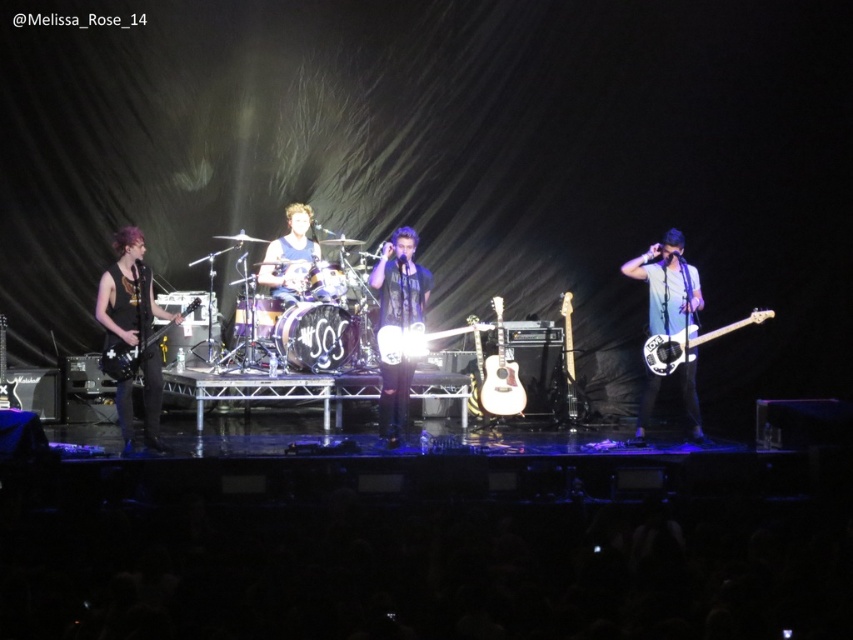
Question: Which point is farther to the camera?

Choices:
 (A) white matte acoustic guitar at center
 (B) blue fabric shirt at center
 (C) black matte shirt at center

Answer: (A)

Question: Can you confirm if black matte shirt at center is positioned to the left of white matte acoustic guitar at center?

Choices:
 (A) yes
 (B) no

Answer: (A)

Question: Is the position of black matte guitar at left less distant than that of white matte acoustic guitar at center?

Choices:
 (A) no
 (B) yes

Answer: (B)

Question: Is black matte shirt at center further to the viewer compared to shiny gold electric guitar at center?

Choices:
 (A) yes
 (B) no

Answer: (B)

Question: Which object is farther from the camera taking this photo?

Choices:
 (A) blue fabric shirt at center
 (B) light brown acoustic guitar at center

Answer: (A)

Question: Which of the following is the closest to the observer?

Choices:
 (A) black matte guitar at left
 (B) shiny gold electric guitar at center
 (C) shiny silver bass at right

Answer: (A)